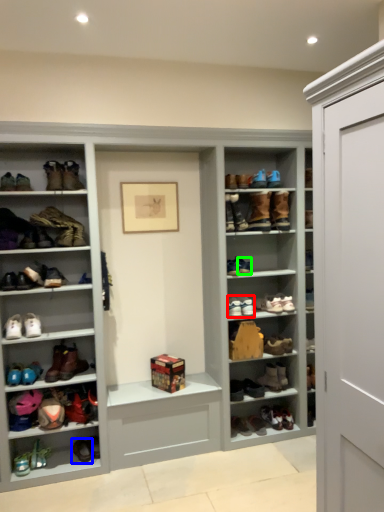
Question: Which object is positioned farthest from shoe (highlighted by a red box)? Select from footwear (highlighted by a blue box) and shoe (highlighted by a green box).

Choices:
 (A) footwear
 (B) shoe

Answer: (A)